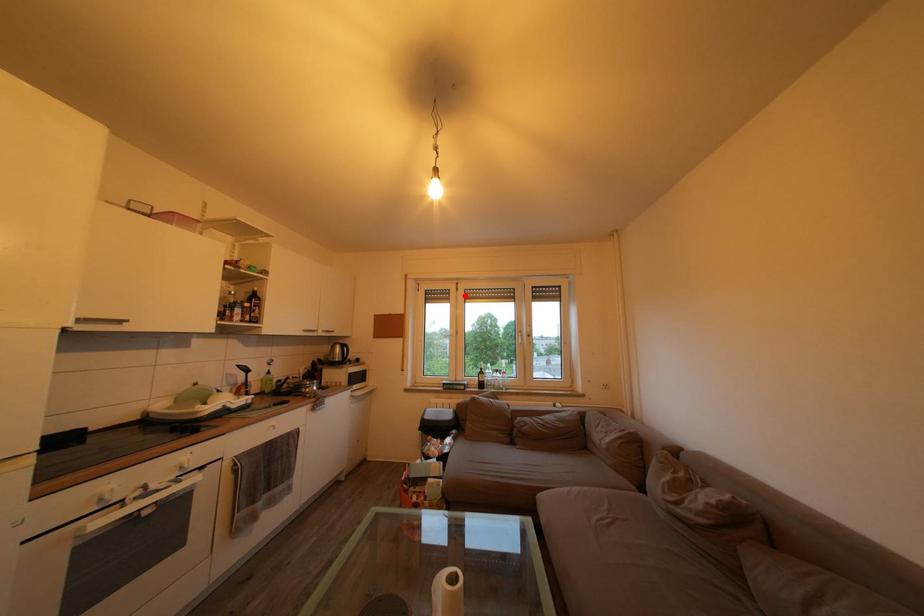
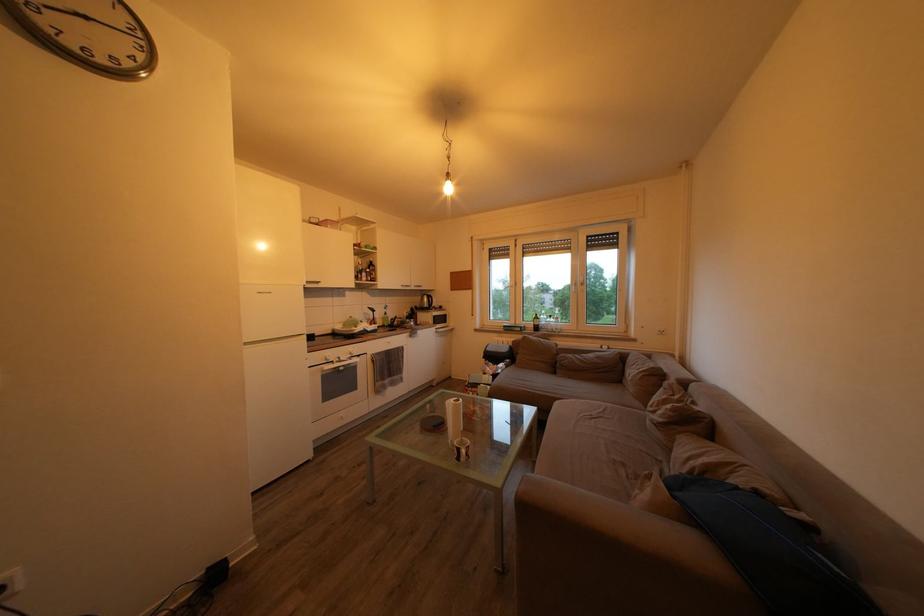
Question: I am providing you with two images of the same scene from different viewpoints. A red point is marked on the first image. Can you still see the location of the red point in image 2?

Choices:
 (A) Yes
 (B) No

Answer: (A)